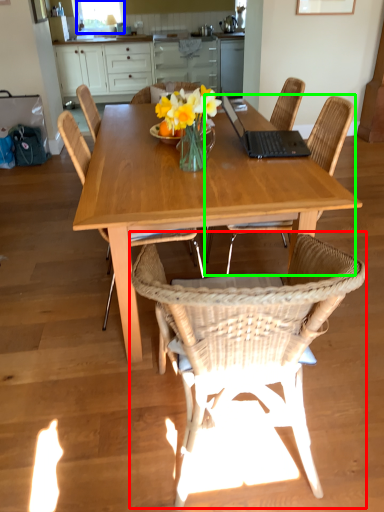
Question: Which object is positioned closest to chair (highlighted by a red box)? Select from window screen (highlighted by a blue box) and chair (highlighted by a green box).

Choices:
 (A) window screen
 (B) chair

Answer: (B)